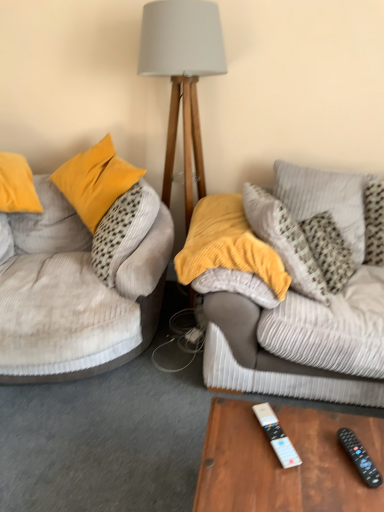
Question: Is white plastic remote control at lower center, which appears as the second remote control when viewed from the right, to the left or to the right of black plastic remote control at lower right, the first remote control when ordered from right to left, in the image?

Choices:
 (A) right
 (B) left

Answer: (B)

Question: Is white plastic remote control at lower center, which appears as the second remote control when viewed from the right, wider or thinner than black plastic remote control at lower right, the first remote control when ordered from right to left?

Choices:
 (A) wide
 (B) thin

Answer: (A)

Question: Which object is positioned closest to the light gray fabric lampshade at center?

Choices:
 (A) black plastic remote control at lower right, the first remote control when ordered from right to left
 (B) white plastic remote control at lower center, which appears as the second remote control when viewed from the right
 (C) wooden table at lower center
 (D) velvet beige couch at left
 (E) corduroy pillow at upper right, arranged as the second pillow when viewed from the left

Answer: (E)

Question: Which of these objects is positioned closest to the corduroy pillow at upper right, arranged as the second pillow when viewed from the left?

Choices:
 (A) light gray fabric lampshade at center
 (B) black plastic remote control at lower right, positioned as the 2th remote control in left-to-right order
 (C) velvet beige couch at left
 (D) white plastic remote control at lower center, which is counted as the first remote control, starting from the left
 (E) velvety yellow pillow at center, the second pillow from the right

Answer: (E)